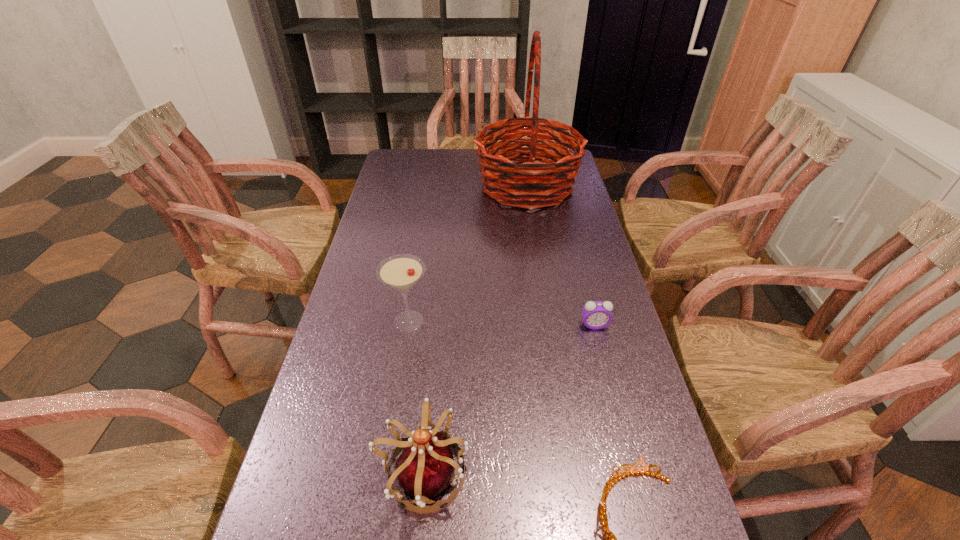
Locate an element on the screen. The height and width of the screenshot is (540, 960). free spot that satisfies the following two spatial constraints: 1. on the face of the alarm clock; 2. on the front-facing side of the taller tiara is located at coordinates (633, 474).